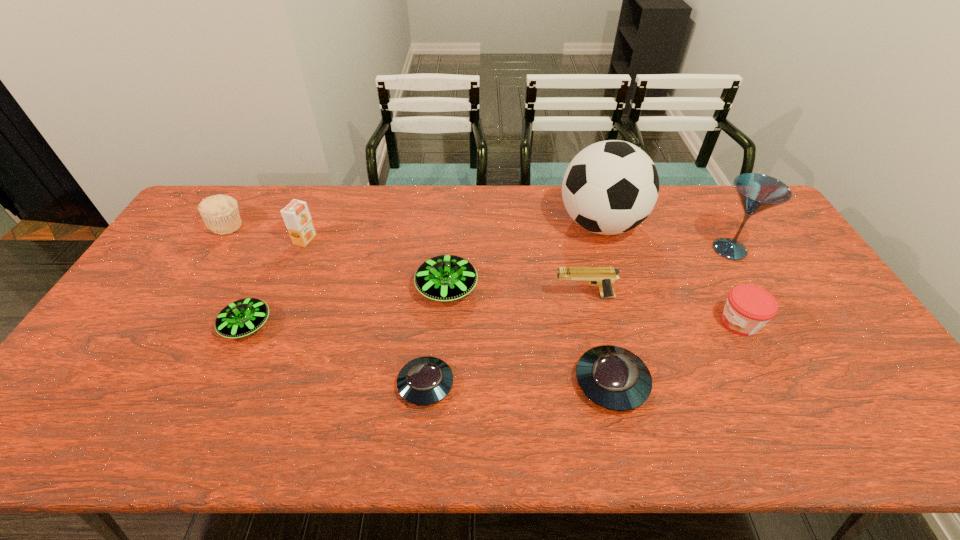
What are the coordinates of `black soccer ball` in the screenshot? It's located at (610, 187).

Find the location of a particular element. soccer ball is located at coordinates (610, 187).

Locate an element on the screen. The height and width of the screenshot is (540, 960). the ninth shortest object is located at coordinates (757, 192).

At what (x,y) coordinates should I click in order to perform the action: click on the third tallest object. Please return your answer as a coordinate pair (x, y). This screenshot has width=960, height=540. Looking at the image, I should click on (296, 215).

The image size is (960, 540). Find the location of `orange orange juice`. orange orange juice is located at coordinates (296, 215).

The height and width of the screenshot is (540, 960). I want to click on beige muffin, so click(220, 213).

Locate an element on the screen. muffin is located at coordinates (220, 213).

Locate an element on the screen. tan pistol is located at coordinates (603, 277).

Image resolution: width=960 pixels, height=540 pixels. In order to click on red jam in this screenshot , I will do `click(748, 308)`.

Locate an element on the screen. This screenshot has height=540, width=960. the right green saucer is located at coordinates (444, 278).